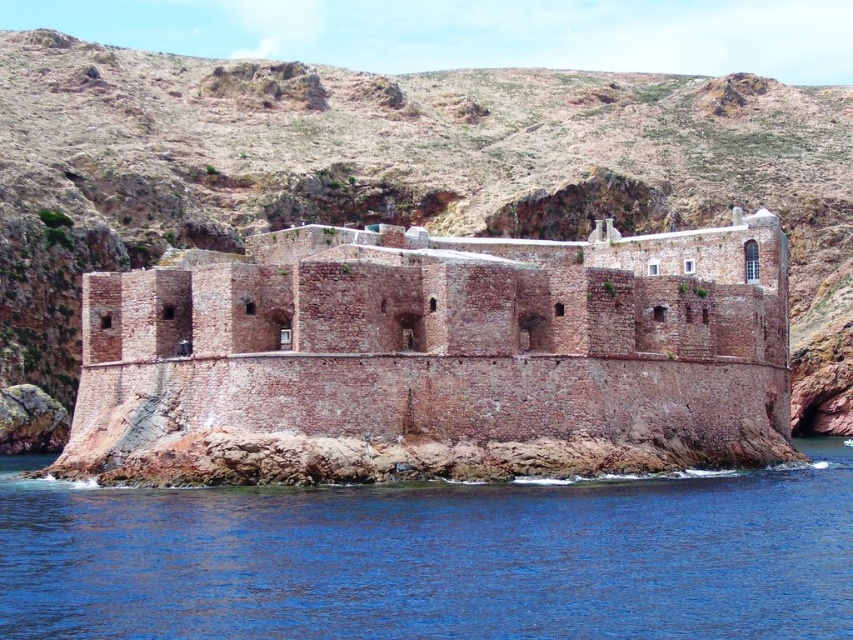
Question: Is brown stone castle at center wider than blue water at lower left?

Choices:
 (A) no
 (B) yes

Answer: (A)

Question: Which point appears closest to the camera in this image?

Choices:
 (A) (610, 586)
 (B) (640, 273)

Answer: (A)

Question: Which point is farther to the camera?

Choices:
 (A) blue water at lower left
 (B) rustic stone hillside at upper center

Answer: (B)

Question: Can you confirm if brown stone castle at center is positioned to the left of blue water at lower left?

Choices:
 (A) no
 (B) yes

Answer: (B)

Question: Which of the following is the closest to the observer?

Choices:
 (A) (419, 308)
 (B) (113, 177)

Answer: (A)

Question: From the image, what is the correct spatial relationship of rustic stone hillside at upper center in relation to blue water at lower left?

Choices:
 (A) above
 (B) below

Answer: (A)